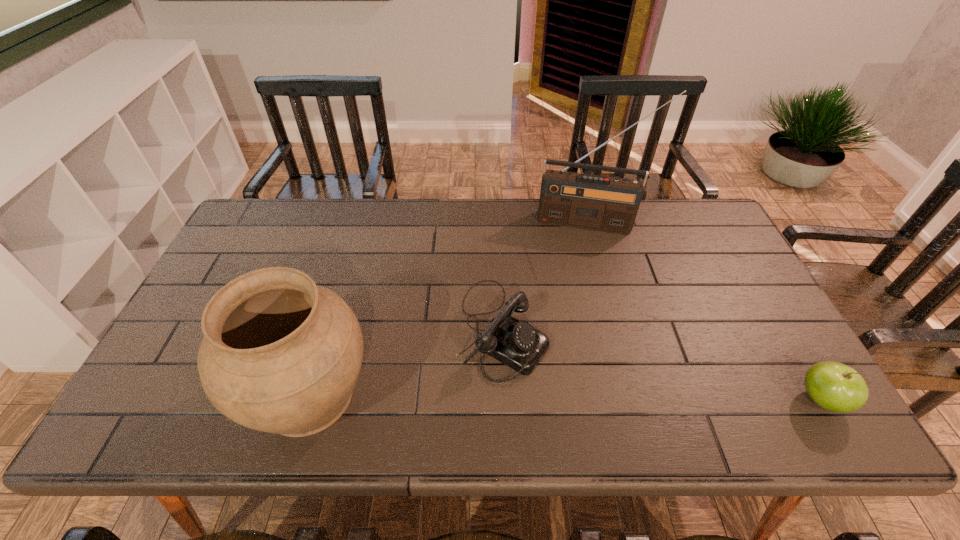
Image resolution: width=960 pixels, height=540 pixels. I want to click on vacant region at the far edge of the desktop, so tap(633, 231).

Where is `free point at the near edge`? free point at the near edge is located at coordinates (444, 394).

Identify the location of free space at the right edge of the desktop. (721, 279).

The height and width of the screenshot is (540, 960). What are the coordinates of `vacant space at the far left corner` in the screenshot? It's located at (299, 211).

In the image, there is a desktop. Where is `vacant area at the near left corner`? The height and width of the screenshot is (540, 960). vacant area at the near left corner is located at coordinates (160, 370).

At what (x,y) coordinates should I click in order to perform the action: click on vacant area between the rightmost object and the farthest object. Please return your answer as a coordinate pair (x, y). Looking at the image, I should click on (706, 311).

At what (x,y) coordinates should I click in order to perform the action: click on unoccupied position between the telephone and the urn. Please return your answer as a coordinate pair (x, y). The height and width of the screenshot is (540, 960). Looking at the image, I should click on (405, 361).

What are the coordinates of `free space between the telephone and the farthest object` in the screenshot? It's located at [x=546, y=275].

The image size is (960, 540). I want to click on empty space between the second object from left to right and the urn, so click(x=405, y=361).

This screenshot has height=540, width=960. Identify the location of empty space between the tallest object and the telephone. (546, 275).